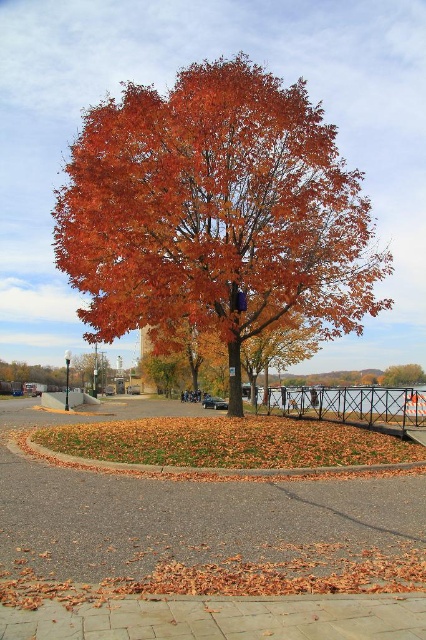
You are a gardener trying to collect leaves from the shiny orange leaves at center to the brown brick pavement at center. Can you reach the leaves without stepping onto the pavement?

The distance between the shiny orange leaves at center and the brown brick pavement at center is 6.73 meters, so you can easily reach the leaves without stepping onto the pavement since the distance is manageable.